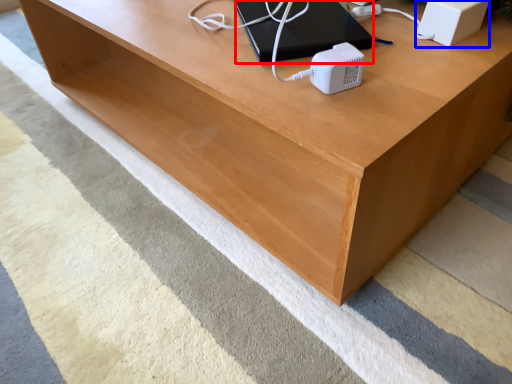
Question: Which object appears closest to the camera in this image, computer (highlighted by a red box) or speaker (highlighted by a blue box)?

Choices:
 (A) computer
 (B) speaker

Answer: (B)